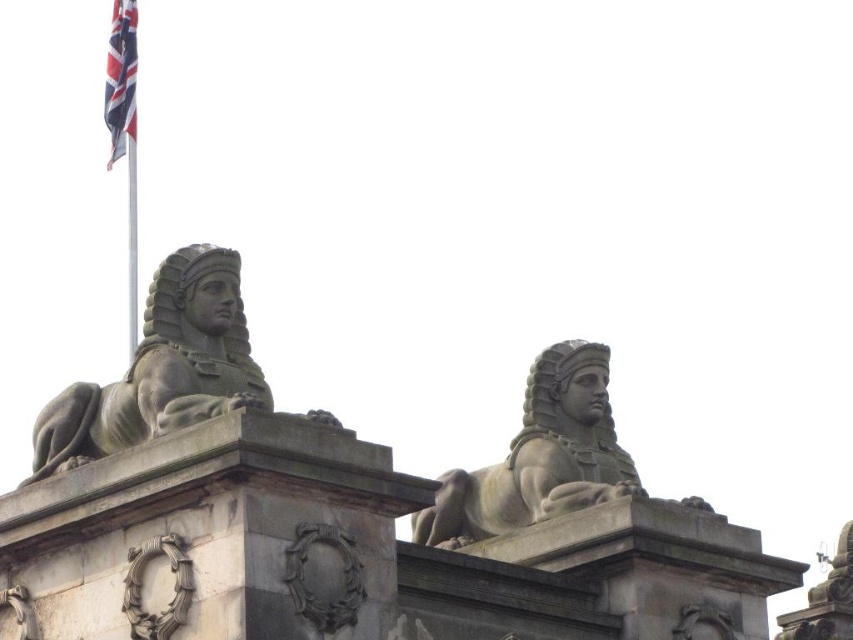
Where is `carved stone wreath at center`? This screenshot has width=853, height=640. carved stone wreath at center is located at coordinates (173, 588).

Between carved stone wreath at center and union jack fabric at upper left, which one has less height?

With less height is carved stone wreath at center.

Is point (129, 577) farther from camera compared to point (111, 104)?

No, (129, 577) is in front of (111, 104).

Where is `carved stone wreath at center`? carved stone wreath at center is located at coordinates (173, 588).

Between matte stone sphinx at upper left and carved stone wreath at center, which one has more height?

With more height is matte stone sphinx at upper left.

Describe the element at coordinates (161, 368) in the screenshot. This screenshot has height=640, width=853. I see `matte stone sphinx at upper left` at that location.

Is point (242, 394) more distant than point (175, 628)?

Yes, it is behind point (175, 628).

Where is `matte stone sphinx at upper left`? The height and width of the screenshot is (640, 853). matte stone sphinx at upper left is located at coordinates (161, 368).

Who is positioned more to the right, matte stone sphinx at upper left or union jack fabric at upper left?

matte stone sphinx at upper left is more to the right.

In the scene shown: Does matte stone sphinx at upper left have a greater width compared to union jack fabric at upper left?

Yes.

Describe the element at coordinates (161, 368) in the screenshot. The width and height of the screenshot is (853, 640). I see `matte stone sphinx at upper left` at that location.

Locate an element on the screen. Image resolution: width=853 pixels, height=640 pixels. matte stone sphinx at upper left is located at coordinates pyautogui.click(x=161, y=368).